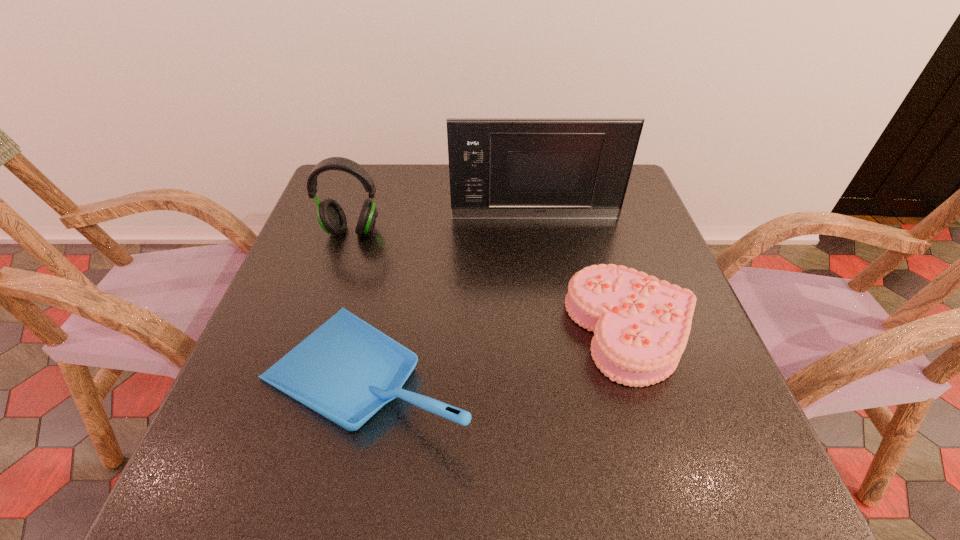
I want to click on empty space that is in between the headset and the shortest object, so click(492, 280).

Find the location of a particular element. vacant point located between the shortest object and the dustpan is located at coordinates (500, 353).

Where is `object that is the second closest to the microwave oven`? This screenshot has height=540, width=960. object that is the second closest to the microwave oven is located at coordinates (641, 325).

At what (x,y) coordinates should I click in order to perform the action: click on object that is the nearest to the second tallest object. Please return your answer as a coordinate pair (x, y). Looking at the image, I should click on (500, 168).

Where is `free location that satisfies the following two spatial constraints: 1. on the ear cups of the third shortest object; 2. on the right side of the cake`? The image size is (960, 540). free location that satisfies the following two spatial constraints: 1. on the ear cups of the third shortest object; 2. on the right side of the cake is located at coordinates (319, 330).

At what (x,y) coordinates should I click in order to perform the action: click on free spot that satisfies the following two spatial constraints: 1. on the front panel of the microwave oven; 2. on the right side of the cake. Please return your answer as a coordinate pair (x, y). Looking at the image, I should click on (552, 330).

The image size is (960, 540). Identify the location of vacant region that satisfies the following two spatial constraints: 1. on the ear cups of the second shortest object; 2. on the right side of the third nearest object. (303, 375).

Where is `free location that satisfies the following two spatial constraints: 1. on the ear cups of the third nearest object; 2. on the left side of the shortest object`? Image resolution: width=960 pixels, height=540 pixels. free location that satisfies the following two spatial constraints: 1. on the ear cups of the third nearest object; 2. on the left side of the shortest object is located at coordinates (319, 330).

The width and height of the screenshot is (960, 540). I want to click on free space in the image that satisfies the following two spatial constraints: 1. on the ear cups of the dustpan; 2. on the left side of the second farthest object, so click(x=303, y=375).